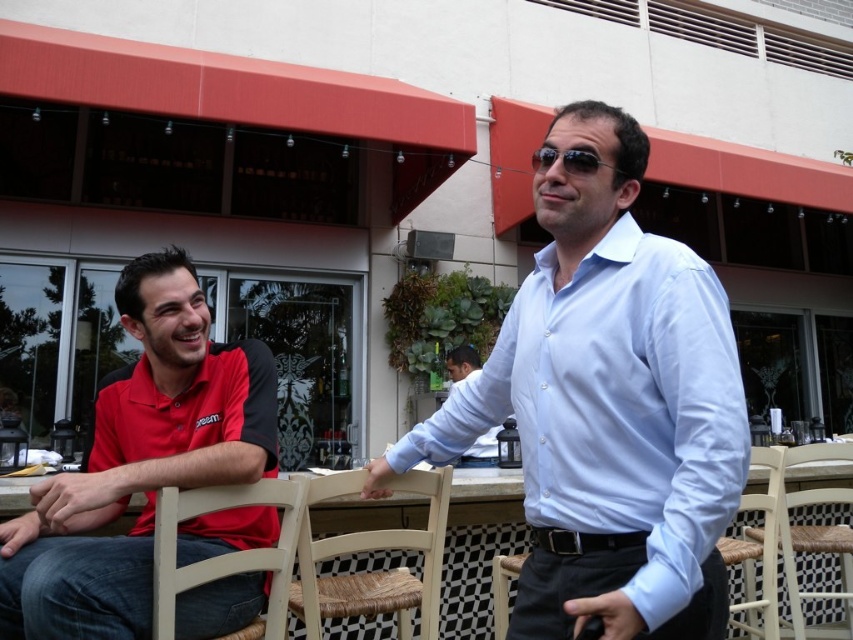
Is woven wood chair at center positioned at the back of light beige wood chair at lower left?

Yes, it is behind light beige wood chair at lower left.

What are the coordinates of `woven wood chair at center` in the screenshot? It's located at (370, 550).

Does point (660, 368) come farther from viewer compared to point (811, 545)?

That is False.

What are the coordinates of `white glossy shirt at center` in the screenshot? It's located at (608, 403).

Where is `white glossy shirt at center`? This screenshot has width=853, height=640. white glossy shirt at center is located at coordinates (x=608, y=403).

Can you confirm if woven wood chair at lower right is wider than light blue shirt at center?

Correct, the width of woven wood chair at lower right exceeds that of light blue shirt at center.

Can you confirm if woven wood chair at lower right is taller than light blue shirt at center?

Yes, woven wood chair at lower right is taller than light blue shirt at center.

Is point (730, 609) behind point (457, 380)?

No.

Find the location of a particular element. The width and height of the screenshot is (853, 640). woven wood chair at lower right is located at coordinates tap(759, 547).